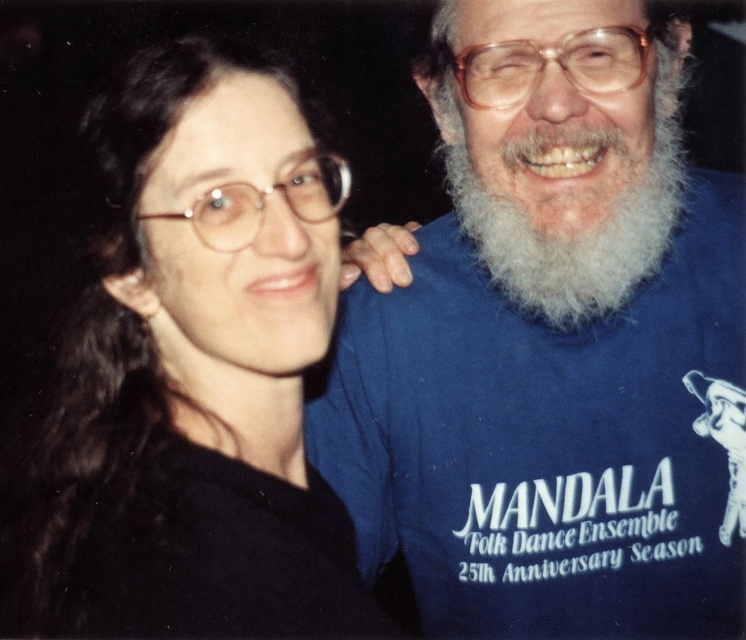
Question: Based on their relative distances, which object is farther from the blue cotton t-shirt at right?

Choices:
 (A) black matte shirt at left
 (B) white fluffy beard at upper right

Answer: (A)

Question: Is blue cotton t-shirt at right to the left of black matte shirt at left from the viewer's perspective?

Choices:
 (A) yes
 (B) no

Answer: (B)

Question: Can you confirm if blue cotton t-shirt at right is smaller than white fluffy beard at upper right?

Choices:
 (A) yes
 (B) no

Answer: (B)

Question: Does black matte shirt at left come in front of white fluffy beard at upper right?

Choices:
 (A) yes
 (B) no

Answer: (A)

Question: Based on their relative distances, which object is nearer to the white fluffy beard at upper right?

Choices:
 (A) black matte shirt at left
 (B) blue cotton t-shirt at right

Answer: (B)

Question: Among these objects, which one is farthest from the camera?

Choices:
 (A) blue cotton t-shirt at right
 (B) black matte shirt at left

Answer: (A)